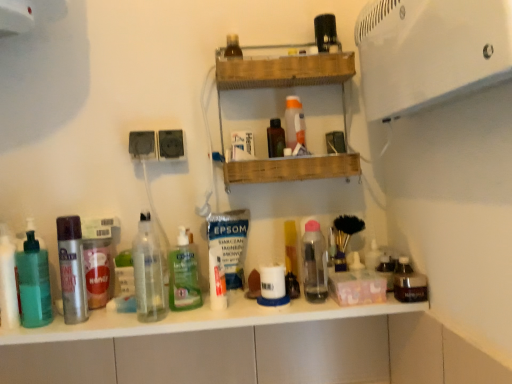
Where is `vacant area that is situated to the right of clear glass bottle at center, the 3th bottle from the left`? vacant area that is situated to the right of clear glass bottle at center, the 3th bottle from the left is located at coordinates (208, 317).